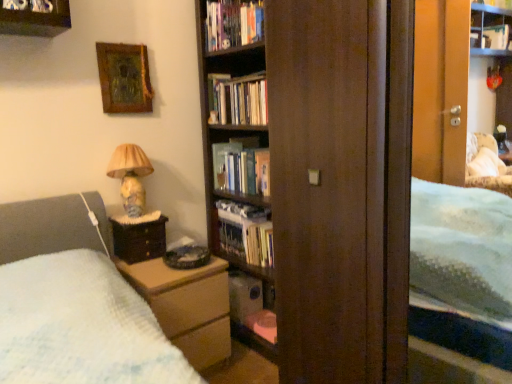
What do you see at coordinates (245, 232) in the screenshot? This screenshot has width=512, height=384. I see `hardcover book at center, positioned as the 2th book in bottom-to-top order` at bounding box center [245, 232].

Locate an element on the screen. brown wood nightstand at left is located at coordinates (139, 240).

The image size is (512, 384). Describe the element at coordinates (139, 240) in the screenshot. I see `brown wood nightstand at left` at that location.

Describe the element at coordinates (124, 78) in the screenshot. This screenshot has width=512, height=384. I see `wooden framed artwork at upper left` at that location.

You are a GUI agent. You are given a task and a screenshot of the screen. Output one action in this format:
    pyautogui.click(x=<x>, y=<y>)
    Task: Click on the hardcover book at center, positioned as the 2th book in bottom-to-top order
    
    Given the screenshot: What is the action you would take?
    pyautogui.click(x=245, y=232)

From the image's perspective, which is above, wooden framed artwork at upper left or hardcover book at center?

wooden framed artwork at upper left.

What's the angular difference between wooden framed artwork at upper left and hardcover book at center's facing directions?

90 degrees separate the facing orientations of wooden framed artwork at upper left and hardcover book at center.

In terms of height, does wooden framed artwork at upper left look taller or shorter compared to hardcover book at center?

Considering their sizes, wooden framed artwork at upper left has more height than hardcover book at center.

From a real-world perspective, is wooden framed artwork at upper left positioned above or below hardcover book at center?

wooden framed artwork at upper left is above hardcover book at center.

Are hardcover book at center, which is the 4th book in top-to-bottom order, and matte ceramic lamp at left making contact?

hardcover book at center, which is the 4th book in top-to-bottom order, and matte ceramic lamp at left are not in contact.

Does point (258, 215) come in front of point (136, 159)?

No, (258, 215) is behind (136, 159).

The height and width of the screenshot is (384, 512). There is a matte ceramic lamp at left. What are the coordinates of `the 2nd book below it (from a real-world perspective)` in the screenshot? It's located at (245, 232).

Is hardcover book at center, which is counted as the third book, starting from the bottom, positioned behind matte plastic shelf at lower center?

No.

Are hardcover book at center, arranged as the 3th book when viewed from the top, and matte plastic shelf at lower center beside each other?

Result: hardcover book at center, arranged as the 3th book when viewed from the top, and matte plastic shelf at lower center are not in contact.

Can you confirm if hardcover book at center, which is counted as the third book, starting from the bottom, is bigger than matte plastic shelf at lower center?

Yes, hardcover book at center, which is counted as the third book, starting from the bottom, is bigger than matte plastic shelf at lower center.

Looking at this image, does hardcover book at center, arranged as the 3th book when viewed from the top, turn towards matte plastic shelf at lower center?

No, hardcover book at center, arranged as the 3th book when viewed from the top, is not facing towards matte plastic shelf at lower center.

Which is correct: hardcover book at center, positioned as the 2th book in bottom-to-top order, is inside hardcover book at upper center, acting as the 1th book starting from the top, or outside of it?

hardcover book at center, positioned as the 2th book in bottom-to-top order, cannot be found inside hardcover book at upper center, acting as the 1th book starting from the top.

From a real-world perspective, is hardcover book at center, positioned as the 2th book in bottom-to-top order, located higher than hardcover book at upper center, the 5th book positioned from the bottom?

No, from a real-world perspective, hardcover book at center, positioned as the 2th book in bottom-to-top order, is not over hardcover book at upper center, the 5th book positioned from the bottom

Is point (259, 237) closer or farther from the camera than point (253, 17)?

Point (259, 237).

Is hardcover book at center, positioned as the 2th book in bottom-to-top order, placed right next to hardcover book at upper center, acting as the 1th book starting from the top?

hardcover book at center, positioned as the 2th book in bottom-to-top order, is not next to hardcover book at upper center, acting as the 1th book starting from the top, and they're not touching.

Considering the points (139, 189) and (231, 311), which point is behind, point (139, 189) or point (231, 311)?

The point (231, 311) is more distant.

At what (x,y) coordinates should I click in order to perform the action: click on shelf that appears on the right of matte ceramic lamp at left. Please return your answer as a coordinate pair (x, y). The image size is (512, 384). Looking at the image, I should click on (252, 307).

Between matte ceramic lamp at left and matte plastic shelf at lower center, which one appears on the left side from the viewer's perspective?

Positioned to the left is matte ceramic lamp at left.

How different are the orientations of matte ceramic lamp at left and matte plastic shelf at lower center in degrees?

The facing directions of matte ceramic lamp at left and matte plastic shelf at lower center are 87 degrees apart.

Looking at this image, considering the relative sizes of hardcover book at center, marked as the second book in a top-to-bottom arrangement, and matte plastic shelf at lower center in the image provided, is hardcover book at center, marked as the second book in a top-to-bottom arrangement, taller than matte plastic shelf at lower center?

Yes.

Is hardcover book at center, marked as the second book in a top-to-bottom arrangement, inside or outside of matte plastic shelf at lower center?

hardcover book at center, marked as the second book in a top-to-bottom arrangement, is not enclosed by matte plastic shelf at lower center.

Is hardcover book at center, which appears as the 4th book when ordered from the bottom, not close to matte plastic shelf at lower center?

No, hardcover book at center, which appears as the 4th book when ordered from the bottom, is not far from matte plastic shelf at lower center.

Is hardcover book at center, marked as the second book in a top-to-bottom arrangement, positioned with its back to matte plastic shelf at lower center?

No, hardcover book at center, marked as the second book in a top-to-bottom arrangement, is not facing away from matte plastic shelf at lower center.

Based on their positions, is wooden framed artwork at upper left located to the left or right of matte plastic shelf at lower center?

Based on their positions, wooden framed artwork at upper left is located to the left of matte plastic shelf at lower center.

This screenshot has width=512, height=384. I want to click on shelf below the wooden framed artwork at upper left (from the image's perspective), so click(x=252, y=307).

Which is in front, point (116, 113) or point (242, 320)?

The point (116, 113) is more forward.

In the scene shown: From the image's perspective, is wooden framed artwork at upper left located above matte plastic shelf at lower center?

Indeed, from the image's perspective, wooden framed artwork at upper left is shown above matte plastic shelf at lower center.

In the image, there is a wooden framed artwork at upper left. What are the coordinates of `paperback book below it (from a real-world perspective)` in the screenshot? It's located at (223, 162).

From the image's perspective, count 1st books downward from the matte ceramic lamp at left and point to it. Please provide its 2D coordinates.

[(245, 232)]

Based on their spatial positions, is matte ceramic lamp at left or brown wood nightstand at left further from wooden bookcase at center?

matte ceramic lamp at left.

When comparing their distances from wooden bookcase at center, does hardcover book at upper center, acting as the 1th book starting from the top, or matte ceramic lamp at left seem closer?

matte ceramic lamp at left lies closer to wooden bookcase at center than the other object.

Based on their spatial positions, is brown wood nightstand at left or matte plastic shelf at lower center closer to wooden framed artwork at upper left?

brown wood nightstand at left lies closer to wooden framed artwork at upper left than the other object.

Based on their spatial positions, is matte plastic shelf at lower center or hardcover book at center, positioned as the 2th book in bottom-to-top order, further from brown wood nightstand at left?

matte plastic shelf at lower center is positioned further to the anchor brown wood nightstand at left.

When comparing their distances from hardcover book at upper center, acting as the 1th book starting from the top, does brown wood nightstand at left or matte plastic shelf at lower center seem further?

matte plastic shelf at lower center lies further to hardcover book at upper center, acting as the 1th book starting from the top, than the other object.

In the scene shown: Which object lies nearer to the anchor point matte plastic shelf at lower center, hardcover book at center, the 5th book in the top-to-bottom sequence, or hardcover book at center, which appears as the 4th book when ordered from the bottom?

hardcover book at center, the 5th book in the top-to-bottom sequence.

Considering their positions, is hardcover book at center, marked as the 1th book in a bottom-to-top arrangement, positioned closer to hardcover book at center than wooden bookcase at center?

Based on the image, hardcover book at center, marked as the 1th book in a bottom-to-top arrangement, appears to be nearer to hardcover book at center.

Which object lies further to the anchor point hardcover book at center, which is counted as the third book, starting from the bottom, brown wood nightstand at left or wooden framed artwork at upper left?

Among the two, wooden framed artwork at upper left is located further to hardcover book at center, which is counted as the third book, starting from the bottom.

The image size is (512, 384). In order to click on paperback book between hardcover book at center, marked as the second book in a top-to-bottom arrangement, and hardcover book at center, which is the 4th book in top-to-bottom order, in the up-down direction in this screenshot , I will do `click(223, 162)`.

I want to click on table lamp between wooden bookcase at center and hardcover book at center in the front-back direction, so click(130, 176).

Image resolution: width=512 pixels, height=384 pixels. I want to click on paperback book between hardcover book at center, which appears as the 4th book when ordered from the bottom, and wooden chest of drawers at lower left vertically, so click(223, 162).

Locate an element on the screen. Image resolution: width=512 pixels, height=384 pixels. table lamp between wooden bookcase at center and hardcover book at center, the 5th book in the top-to-bottom sequence, from front to back is located at coordinates (130, 176).